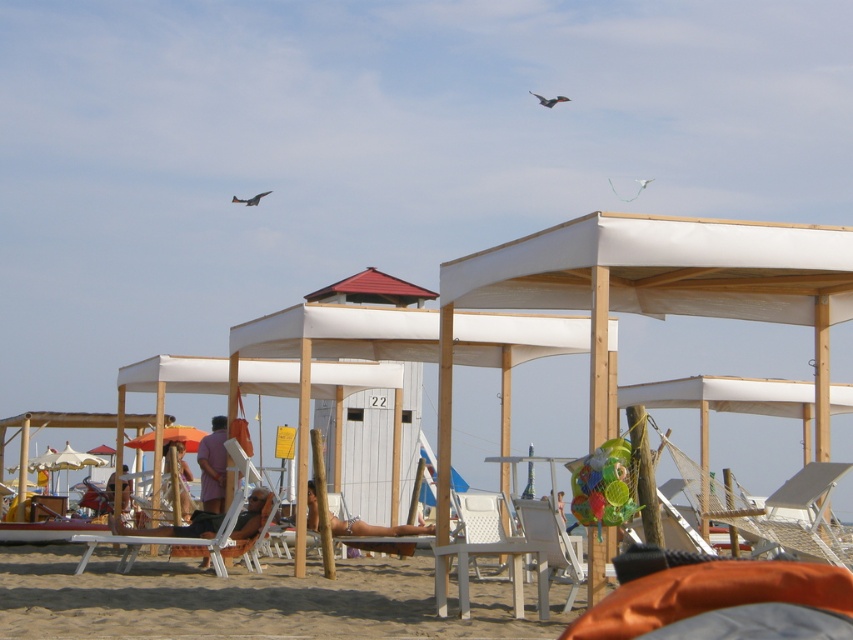
Can you confirm if white plastic lounge chair at center is taller than white plastic chair at center?

Yes.

This screenshot has height=640, width=853. What do you see at coordinates (248, 600) in the screenshot?
I see `white plastic lounge chair at center` at bounding box center [248, 600].

Looking at this image, who is more forward, (207, 596) or (467, 572)?

Point (467, 572) is in front.

The image size is (853, 640). In order to click on white plastic lounge chair at center in this screenshot , I will do `click(248, 600)`.

Which is more to the right, tan skin person at center or tan leather chair at center?

Positioned to the right is tan skin person at center.

Does tan skin person at center lie in front of tan leather chair at center?

No, tan skin person at center is further to the viewer.

Where is `tan skin person at center`? This screenshot has width=853, height=640. tan skin person at center is located at coordinates (375, 529).

Is wooden lounge chair at center positioned before matte purple shirt at center?

Yes, wooden lounge chair at center is closer to the viewer.

Between point (223, 529) and point (224, 451), which one is positioned behind?

The point (224, 451) is behind.

Where is `wooden lounge chair at center`? wooden lounge chair at center is located at coordinates (239, 512).